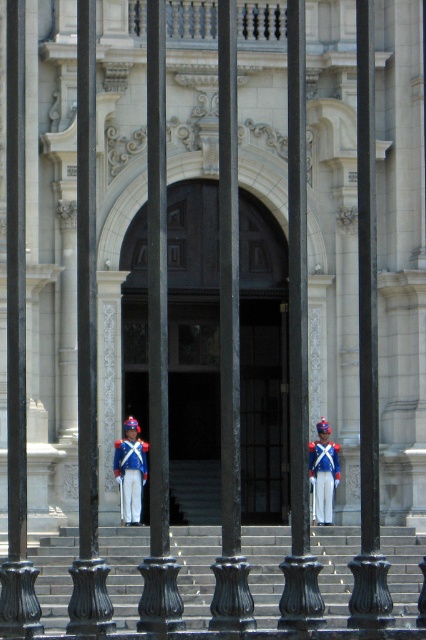
You are a visitor approaching the entrance of the building. You see the gray concrete stairs at center and the blue fabric uniform at center. Which object is located to the left when facing the building?

The gray concrete stairs at center is positioned on the left side of blue fabric uniform at center, so when facing the building, the gray concrete stairs at center is to the left of the blue fabric uniform at center.

You are a maintenance worker needing to place a 1.5m tall ladder against the gray concrete stairs at center and the black metal pole at center. Based on their heights, which object can the ladder be safely placed against?

The black metal pole at center is taller than the gray concrete stairs at center. Since the ladder is 1.5m tall, it can be safely placed against the black metal pole at center as it is taller and provides a stable vertical surface.

You are a visitor approaching the entrance of the building. You see two points marked on the steps leading up to the entrance. Which point is closer to the entrance? The points are labeled as point 1 at coordinates (305,499) and point 2 at coordinates (313,442).

Point 1 at coordinates (305,499) is closer to the entrance because it is in front of point 2 at coordinates (313,442).